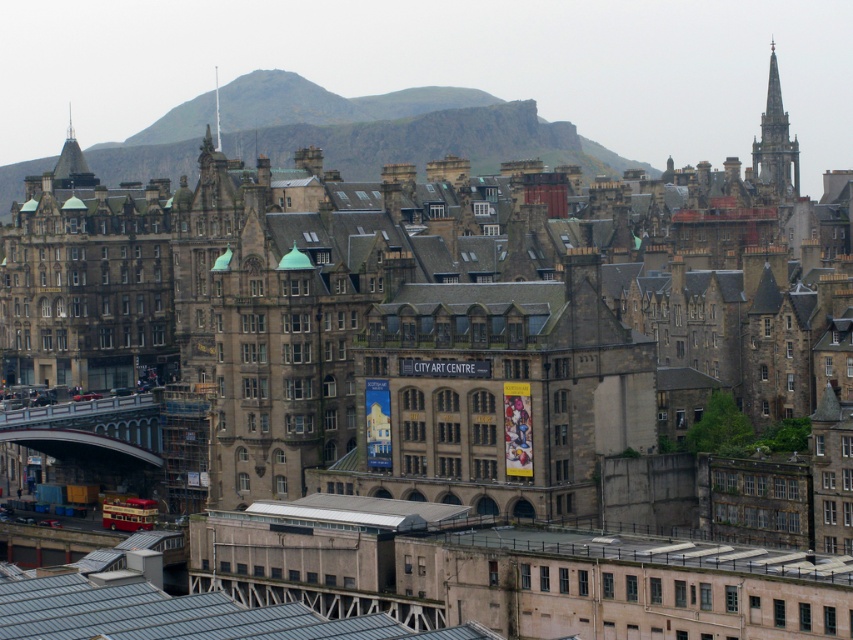
Question: Which point is farther to the camera?

Choices:
 (A) shiny gold spire at upper left
 (B) smooth stone spire at upper center

Answer: (B)

Question: Does stone spire at upper right appear on the left side of shiny gold spire at upper left?

Choices:
 (A) no
 (B) yes

Answer: (A)

Question: Which of the following is the closest to the observer?

Choices:
 (A) shiny gold spire at upper left
 (B) smooth stone spire at upper center
 (C) stone spire at upper right

Answer: (A)

Question: Estimate the real-world distances between objects in this image. Which object is closer to the smooth stone spire at upper center?

Choices:
 (A) shiny gold spire at upper left
 (B) stone spire at upper right

Answer: (A)

Question: Is shiny gold spire at upper left further to camera compared to smooth stone spire at upper center?

Choices:
 (A) yes
 (B) no

Answer: (B)

Question: Can you confirm if stone spire at upper right is positioned above shiny gold spire at upper left?

Choices:
 (A) yes
 (B) no

Answer: (B)